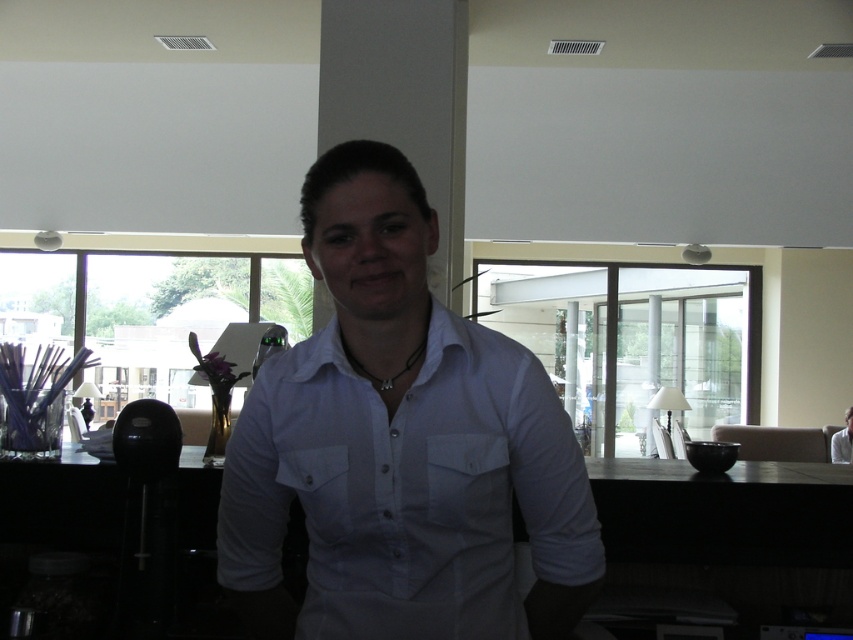
Who is shorter, white cotton shirt at center or white shirt at center?

With less height is white shirt at center.

Who is more forward, (457, 429) or (831, 436)?

Point (457, 429) is in front.

Where is `white cotton shirt at center`? This screenshot has height=640, width=853. white cotton shirt at center is located at coordinates (407, 486).